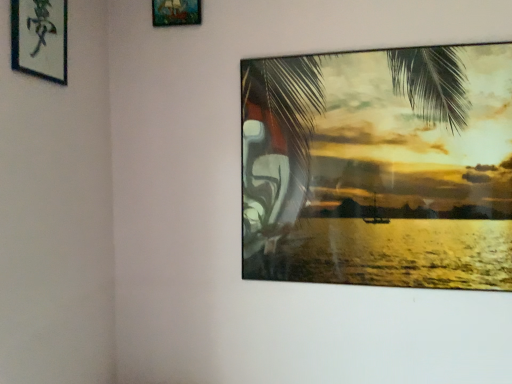
Measure the distance between point (175, 0) and camera.

They are 5.19 feet apart.

What do you see at coordinates (40, 38) in the screenshot?
I see `black paper at upper left, which is counted as the 1th picture frame, starting from the bottom` at bounding box center [40, 38].

Where is `silky green palm tree at upper right`? This screenshot has width=512, height=384. silky green palm tree at upper right is located at coordinates (288, 155).

Can you confirm if wooden frame at upper center, which ranks as the second picture frame in front-to-back order, is taller than black paper at upper left, which is counted as the 1th picture frame, starting from the bottom?

In fact, wooden frame at upper center, which ranks as the second picture frame in front-to-back order, may be shorter than black paper at upper left, which is counted as the 1th picture frame, starting from the bottom.

Is wooden frame at upper center, the first picture frame when ordered from right to left, facing towards black paper at upper left, which is counted as the 1th picture frame, starting from the bottom?

Yes, wooden frame at upper center, the first picture frame when ordered from right to left, faces towards black paper at upper left, which is counted as the 1th picture frame, starting from the bottom.

From a real-world perspective, is wooden frame at upper center, marked as the first picture frame in a top-to-bottom arrangement, beneath black paper at upper left, which ranks as the second picture frame in right-to-left order?

Actually, wooden frame at upper center, marked as the first picture frame in a top-to-bottom arrangement, is physically above black paper at upper left, which ranks as the second picture frame in right-to-left order, in the real world.

Which of these two, wooden frame at upper center, placed as the first picture frame when sorted from back to front, or black paper at upper left, the first picture frame in the left-to-right sequence, is thinner?

With smaller width is wooden frame at upper center, placed as the first picture frame when sorted from back to front.

Is wooden frame at upper center, placed as the first picture frame when sorted from back to front, aimed at silky green palm tree at upper right?

No.

Is wooden frame at upper center, the first picture frame when ordered from right to left, positioned before silky green palm tree at upper right?

No, wooden frame at upper center, the first picture frame when ordered from right to left, is further to the viewer.

Considering the sizes of objects wooden frame at upper center, the 2th picture frame when ordered from left to right, and silky green palm tree at upper right in the image provided, who is bigger, wooden frame at upper center, the 2th picture frame when ordered from left to right, or silky green palm tree at upper right?

With larger size is silky green palm tree at upper right.

From a real-world perspective, who is located higher, silky green palm tree at upper right or wooden frame at upper center, which ranks as the second picture frame in front-to-back order?

wooden frame at upper center, which ranks as the second picture frame in front-to-back order, from a real-world perspective.

From the picture: Does silky green palm tree at upper right have a lesser height compared to wooden frame at upper center, the 2th picture frame when ordered from left to right?

No.

Consider the image. In terms of size, does silky green palm tree at upper right appear bigger or smaller than wooden frame at upper center, the 2th picture frame positioned from the bottom?

silky green palm tree at upper right is bigger than wooden frame at upper center, the 2th picture frame positioned from the bottom.

Which is behind, silky green palm tree at upper right or wooden frame at upper center, the 2th picture frame positioned from the bottom?

wooden frame at upper center, the 2th picture frame positioned from the bottom, is more distant.

In the scene shown: From the image's perspective, is black paper at upper left, which is counted as the 2th picture frame, starting from the back, located above silky green palm tree at upper right?

Yes, from the image's perspective, black paper at upper left, which is counted as the 2th picture frame, starting from the back, is on top of silky green palm tree at upper right.

Could you tell me if black paper at upper left, which ranks as the second picture frame in right-to-left order, is facing silky green palm tree at upper right?

Yes, black paper at upper left, which ranks as the second picture frame in right-to-left order, is facing silky green palm tree at upper right.

Does point (40, 46) come closer to viewer compared to point (267, 85)?

Yes, it is in front of point (267, 85).

What's the angular difference between silky green palm tree at upper right and black paper at upper left, arranged as the second picture frame when viewed from the top,'s facing directions?

The angular difference between silky green palm tree at upper right and black paper at upper left, arranged as the second picture frame when viewed from the top, is 89.7 degrees.

Who is bigger, silky green palm tree at upper right or black paper at upper left, which is counted as the 1th picture frame, starting from the bottom?

silky green palm tree at upper right is bigger.

Looking at this image, looking at their sizes, would you say silky green palm tree at upper right is wider or thinner than black paper at upper left, which is counted as the 2th picture frame, starting from the back?

silky green palm tree at upper right is wider than black paper at upper left, which is counted as the 2th picture frame, starting from the back.

Who is shorter, silky green palm tree at upper right or black paper at upper left, which ranks as the second picture frame in right-to-left order?

With less height is black paper at upper left, which ranks as the second picture frame in right-to-left order.

Is black paper at upper left, which is counted as the 2th picture frame, starting from the back, oriented towards wooden frame at upper center, which ranks as the second picture frame in front-to-back order?

No, black paper at upper left, which is counted as the 2th picture frame, starting from the back, is not oriented towards wooden frame at upper center, which ranks as the second picture frame in front-to-back order.

Would you say black paper at upper left, which is counted as the 1th picture frame, starting from the bottom, is a long distance from wooden frame at upper center, which ranks as the second picture frame in front-to-back order?

black paper at upper left, which is counted as the 1th picture frame, starting from the bottom, is near wooden frame at upper center, which ranks as the second picture frame in front-to-back order, not far away.

Which of these two, black paper at upper left, arranged as the second picture frame when viewed from the top, or wooden frame at upper center, placed as the first picture frame when sorted from back to front, stands taller?

With more height is black paper at upper left, arranged as the second picture frame when viewed from the top.

The image size is (512, 384). Find the location of `picture frame on the left of wooden frame at upper center, marked as the first picture frame in a top-to-bottom arrangement`. picture frame on the left of wooden frame at upper center, marked as the first picture frame in a top-to-bottom arrangement is located at coordinates (40, 38).

At what (x,y) coordinates should I click in order to perform the action: click on picture frame that appears in front of the wooden frame at upper center, placed as the first picture frame when sorted from back to front. Please return your answer as a coordinate pair (x, y). The image size is (512, 384). Looking at the image, I should click on (40, 38).

I want to click on palm tree on the right of the wooden frame at upper center, which ranks as the second picture frame in front-to-back order, so click(288, 155).

Based on their spatial positions, is black paper at upper left, positioned as the first picture frame in front-to-back order, or wooden frame at upper center, the 2th picture frame positioned from the bottom, further from silky green palm tree at upper right?

The object further to silky green palm tree at upper right is black paper at upper left, positioned as the first picture frame in front-to-back order.

From the image, which object appears to be nearer to black paper at upper left, which ranks as the second picture frame in right-to-left order, silky green palm tree at upper right or wooden frame at upper center, marked as the first picture frame in a top-to-bottom arrangement?

wooden frame at upper center, marked as the first picture frame in a top-to-bottom arrangement.

Based on their spatial positions, is black paper at upper left, the first picture frame in the left-to-right sequence, or silky green palm tree at upper right closer to wooden frame at upper center, the first picture frame when ordered from right to left?

black paper at upper left, the first picture frame in the left-to-right sequence.

From the image, which object appears to be nearer to black paper at upper left, which is counted as the 2th picture frame, starting from the back, wooden frame at upper center, marked as the first picture frame in a top-to-bottom arrangement, or silky green palm tree at upper right?

Among the two, wooden frame at upper center, marked as the first picture frame in a top-to-bottom arrangement, is located nearer to black paper at upper left, which is counted as the 2th picture frame, starting from the back.

Estimate the real-world distances between objects in this image. Which object is closer to silky green palm tree at upper right, wooden frame at upper center, the first picture frame when ordered from right to left, or black paper at upper left, positioned as the first picture frame in front-to-back order?

The object closer to silky green palm tree at upper right is wooden frame at upper center, the first picture frame when ordered from right to left.

Estimate the real-world distances between objects in this image. Which object is further from wooden frame at upper center, placed as the first picture frame when sorted from back to front, silky green palm tree at upper right or black paper at upper left, the first picture frame in the left-to-right sequence?

The object further to wooden frame at upper center, placed as the first picture frame when sorted from back to front, is silky green palm tree at upper right.

Find the location of `picture frame located between black paper at upper left, the first picture frame in the left-to-right sequence, and silky green palm tree at upper right in the left-right direction`. picture frame located between black paper at upper left, the first picture frame in the left-to-right sequence, and silky green palm tree at upper right in the left-right direction is located at coordinates point(176,12).